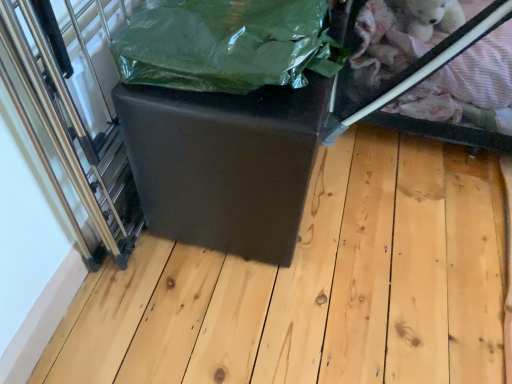
Locate an element on the screen. green plastic bag at center is located at coordinates (226, 44).

The width and height of the screenshot is (512, 384). I want to click on matte black cube at center, so click(x=224, y=163).

Is green plastic bag at center facing towards matte black ottoman at center?

No.

Considering the relative sizes of green plastic bag at center and matte black ottoman at center in the image provided, is green plastic bag at center taller than matte black ottoman at center?

Indeed, green plastic bag at center has a greater height compared to matte black ottoman at center.

Would you say green plastic bag at center is outside matte black ottoman at center?

Yes, green plastic bag at center is located beyond the bounds of matte black ottoman at center.

Is green plastic bag at center far away from matte black ottoman at center?

That's not correct — green plastic bag at center is a little close to matte black ottoman at center.

Is matte black cube at center further to camera compared to transparent plastic glass box at upper right?

No.

Are matte black cube at center and transparent plastic glass box at upper right located far from each other?

They are positioned close to each other.

From the image's perspective, is matte black cube at center positioned above or below transparent plastic glass box at upper right?

Clearly, from the image's perspective, matte black cube at center is below transparent plastic glass box at upper right.

Can you tell me how much matte black cube at center and transparent plastic glass box at upper right differ in facing direction?

The angle between the facing direction of matte black cube at center and the facing direction of transparent plastic glass box at upper right is 90.5 degrees.

Between transparent plastic glass box at upper right and matte black cube at center, which one appears on the right side from the viewer's perspective?

transparent plastic glass box at upper right.

Between transparent plastic glass box at upper right and matte black cube at center, which one has smaller size?

With smaller size is matte black cube at center.

Does transparent plastic glass box at upper right come in front of matte black cube at center?

No, transparent plastic glass box at upper right is further to the viewer.

In the scene shown: Is transparent plastic glass box at upper right spatially inside matte black cube at center, or outside of it?

The correct answer is: outside.

Can we say matte black cube at center lies outside transparent plastic glass door at left?

matte black cube at center lies outside transparent plastic glass door at left's area.

Between matte black cube at center and transparent plastic glass door at left, which one has smaller size?

With smaller size is transparent plastic glass door at left.

Is matte black cube at center turned away from transparent plastic glass door at left?

Yes, matte black cube at center is positioned with its back facing transparent plastic glass door at left.

Considering the sizes of objects matte black cube at center and transparent plastic glass door at left in the image provided, who is thinner, matte black cube at center or transparent plastic glass door at left?

With smaller width is transparent plastic glass door at left.

Where is `plastic bag located above the transparent plastic glass box at upper right (from a real-world perspective)`? plastic bag located above the transparent plastic glass box at upper right (from a real-world perspective) is located at coordinates (226, 44).

Based on the photo, are transparent plastic glass box at upper right and green plastic bag at center making contact?

They are not placed beside each other.

Would you say transparent plastic glass box at upper right is outside green plastic bag at center?

Yes, transparent plastic glass box at upper right is outside of green plastic bag at center.

From the image's perspective, which is below, transparent plastic glass box at upper right or green plastic bag at center?

green plastic bag at center appears lower in the image.

Find the location of `plastic bag located above the transparent plastic glass door at left (from the image's perspective)`. plastic bag located above the transparent plastic glass door at left (from the image's perspective) is located at coordinates (226, 44).

Is transparent plastic glass door at left at the right side of green plastic bag at center?

Incorrect, transparent plastic glass door at left is not on the right side of green plastic bag at center.

Are transparent plastic glass door at left and green plastic bag at center far apart?

That's not correct — transparent plastic glass door at left is a little close to green plastic bag at center.

Looking at this image, does green plastic bag at center have a smaller size compared to matte black cube at center?

Correct, green plastic bag at center occupies less space than matte black cube at center.

Considering the sizes of objects green plastic bag at center and matte black cube at center in the image provided, who is shorter, green plastic bag at center or matte black cube at center?

green plastic bag at center.

From a real-world perspective, which object stands above the other?

green plastic bag at center.

Which object is more forward, green plastic bag at center or matte black cube at center?

green plastic bag at center is more forward.

The image size is (512, 384). I want to click on plastic bag that appears on the left of matte black ottoman at center, so (226, 44).

Where is `table below the transparent plastic glass box at upper right (from the image's perspective)`? The width and height of the screenshot is (512, 384). table below the transparent plastic glass box at upper right (from the image's perspective) is located at coordinates (224, 163).

Which object lies further to the anchor point transparent plastic glass box at upper right, matte black ottoman at center or green plastic bag at center?

green plastic bag at center lies further to transparent plastic glass box at upper right than the other object.

Which object lies nearer to the anchor point matte black ottoman at center, transparent plastic glass door at left or green plastic bag at center?

transparent plastic glass door at left is positioned closer to the anchor matte black ottoman at center.

When comparing their distances from matte black cube at center, does transparent plastic glass door at left or green plastic bag at center seem closer?

Based on the image, green plastic bag at center appears to be nearer to matte black cube at center.

Estimate the real-world distances between objects in this image. Which object is further from transparent plastic glass box at upper right, matte black cube at center or green plastic bag at center?

The object further to transparent plastic glass box at upper right is matte black cube at center.

Looking at the image, which one is located further to matte black cube at center, transparent plastic glass door at left or transparent plastic glass box at upper right?

transparent plastic glass box at upper right lies further to matte black cube at center than the other object.

From the image, which object appears to be nearer to transparent plastic glass box at upper right, transparent plastic glass door at left or green plastic bag at center?

Among the two, green plastic bag at center is located nearer to transparent plastic glass box at upper right.

Considering their positions, is matte black cube at center positioned closer to matte black ottoman at center than transparent plastic glass door at left?

matte black cube at center is positioned closer to the anchor matte black ottoman at center.

Which object lies further to the anchor point matte black cube at center, matte black ottoman at center or transparent plastic glass door at left?

Among the two, matte black ottoman at center is located further to matte black cube at center.

Find the location of `wood situated between transparent plastic glass door at left and transparent plastic glass box at upper right from left to right`. wood situated between transparent plastic glass door at left and transparent plastic glass box at upper right from left to right is located at coordinates (316, 285).

I want to click on wood situated between green plastic bag at center and transparent plastic glass box at upper right from left to right, so click(316, 285).

This screenshot has width=512, height=384. What are the coordinates of `plastic bag between matte black cube at center and transparent plastic glass box at upper right from left to right` in the screenshot? It's located at (226, 44).

At what (x,y) coordinates should I click in order to perform the action: click on table between transparent plastic glass door at left and matte black ottoman at center from left to right. Please return your answer as a coordinate pair (x, y). The image size is (512, 384). Looking at the image, I should click on (224, 163).